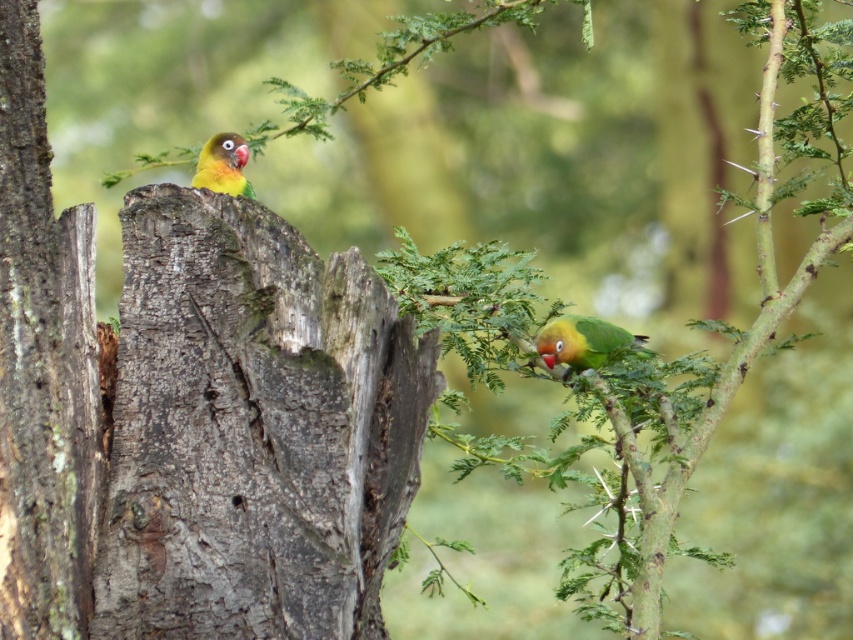
You are standing in the outdoor scene looking at the two birds. Which bird is closer to you, the one at point (107,518) or the one at point (199,182)?

The bird at point (107,518) is closer to you because point (107,518) is in front of point (199,182).